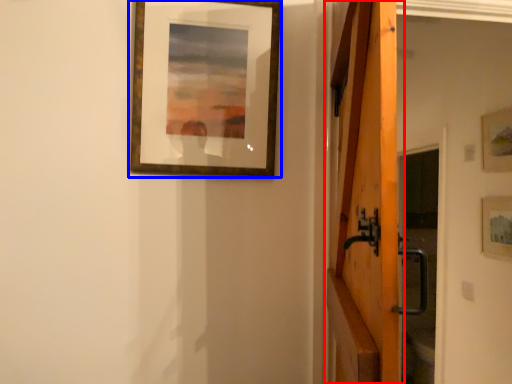
Question: Which point is further to the camera, barn door (highlighted by a red box) or picture frame (highlighted by a blue box)?

Choices:
 (A) barn door
 (B) picture frame

Answer: (B)